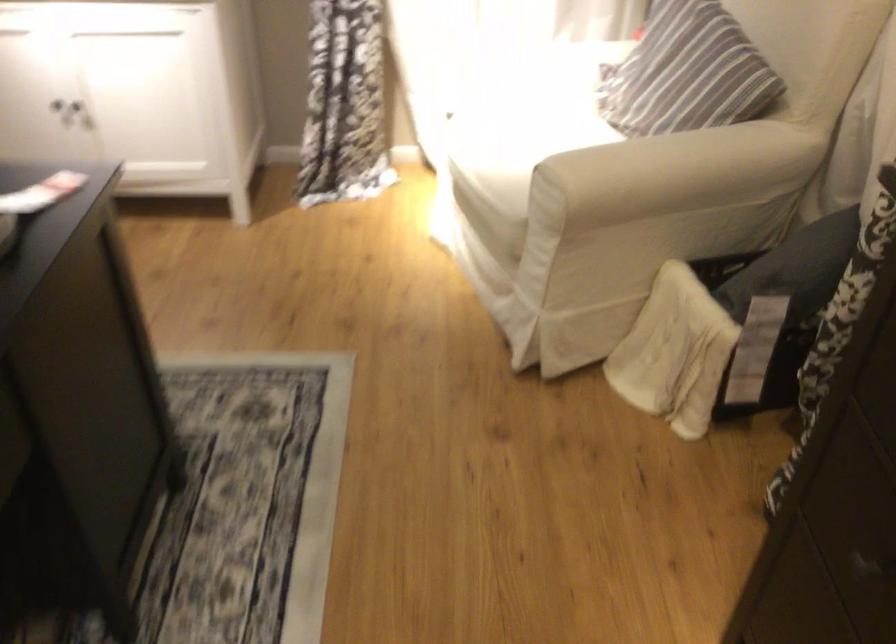
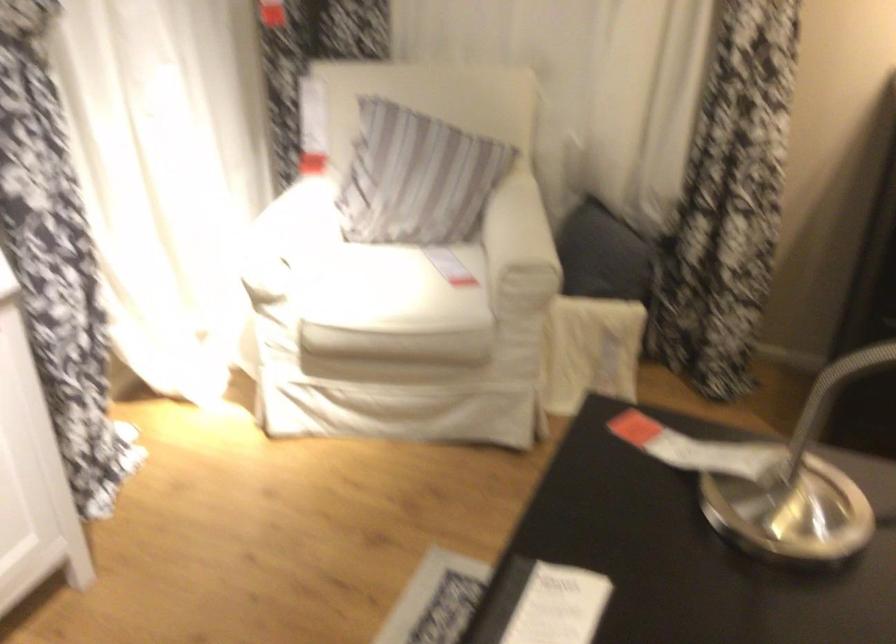
In the second image, find the point that corresponds to (538,154) in the first image.

(388, 287)